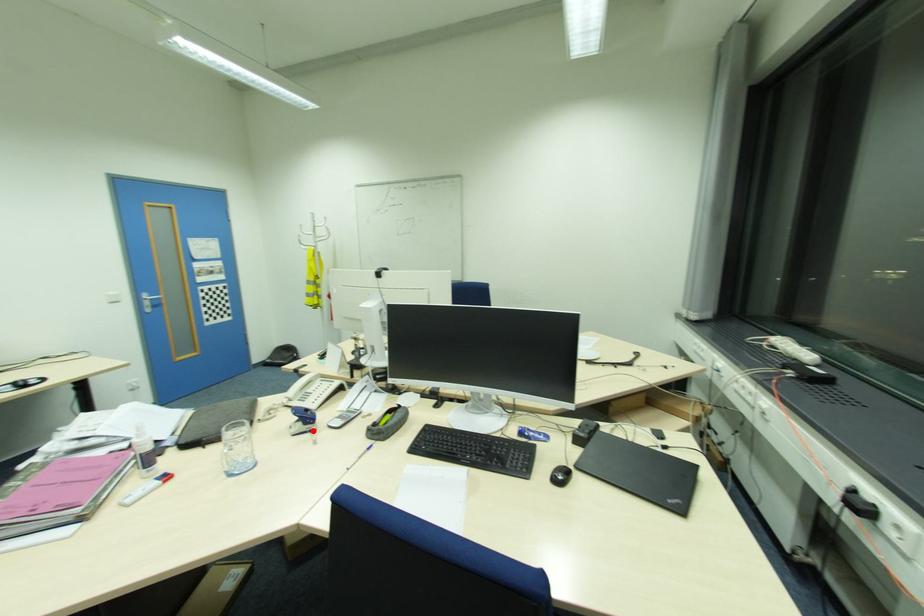
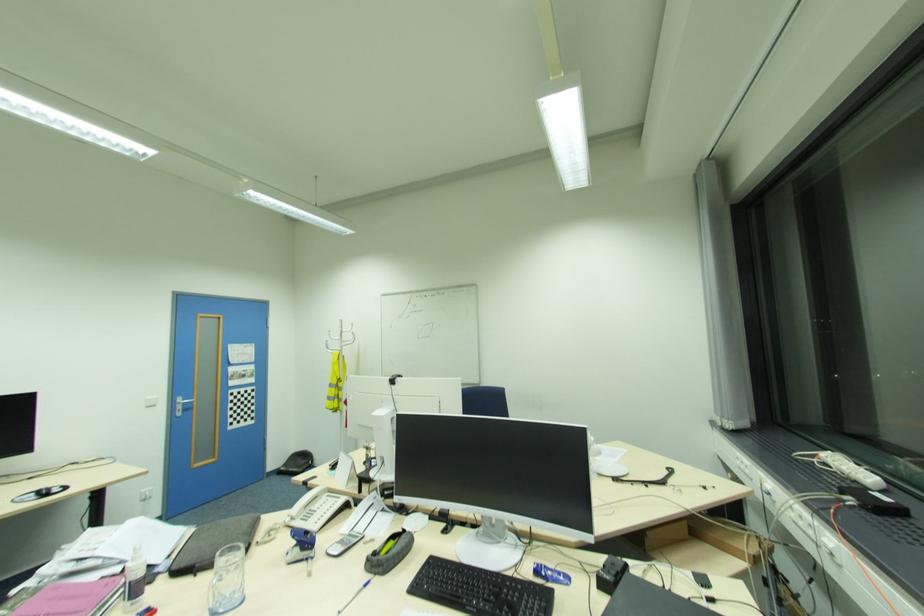
Locate, in the second image, the point that corresponds to the highlighted location in the first image.

(310, 559)